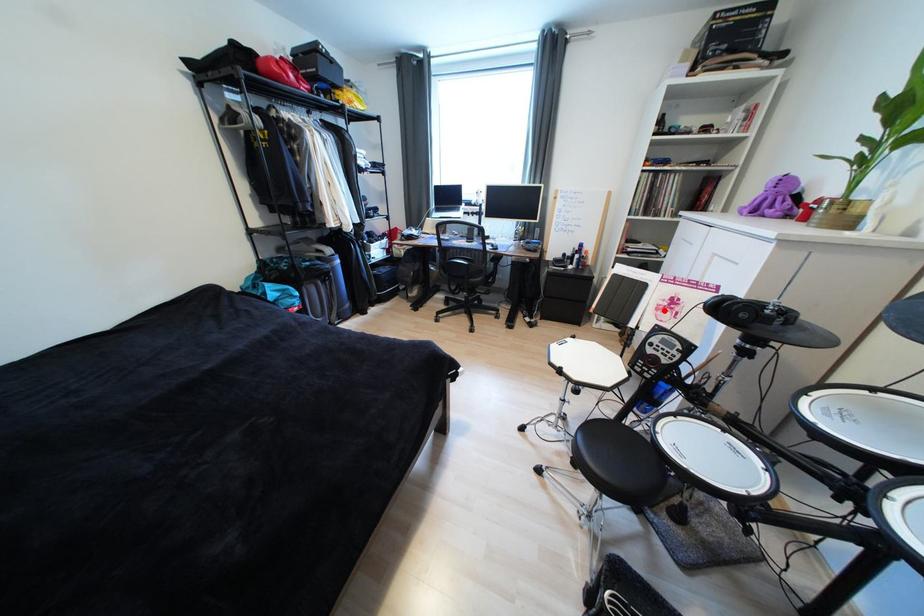
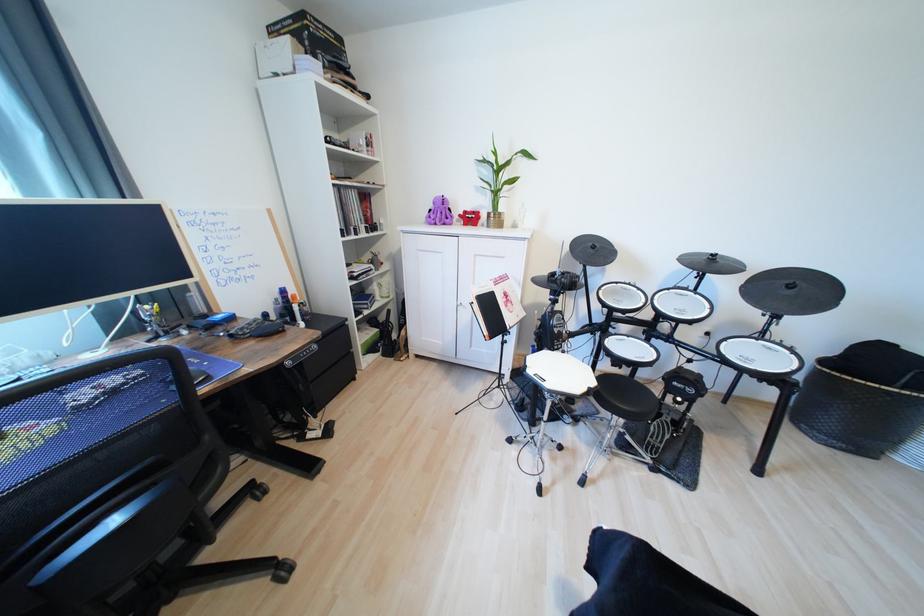
Locate, in the second image, the point that corresponds to the highlighted location in the first image.

(513, 307)